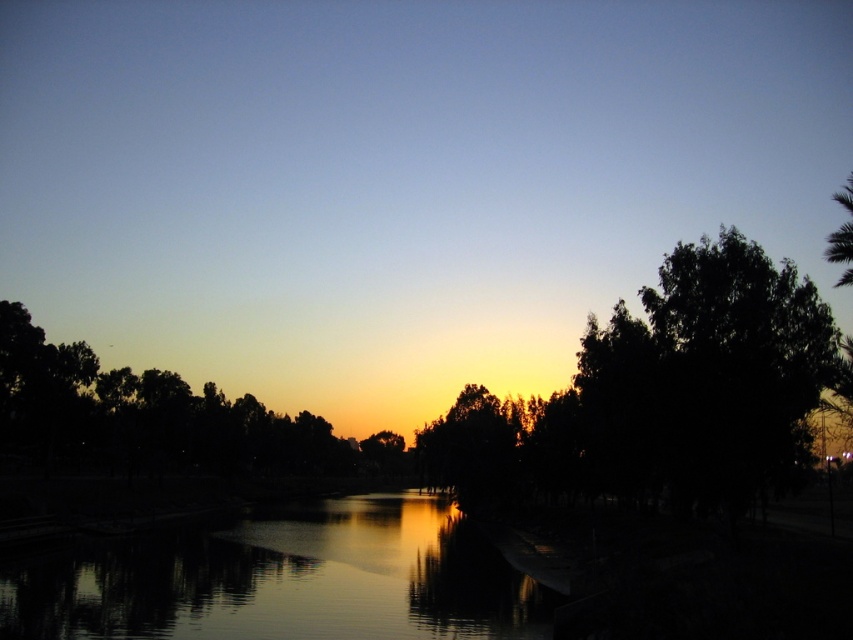
You are an artist trying to paint the sunset scene. You notice the silky smooth water at center and the green leafy tree at upper right. Which object in the scene takes up more space visually?

The green leafy tree at upper right takes up more space visually than the silky smooth water at center because the water has a smaller size compared to the tree.

You are standing on the bank of the river and see the dark green leafy tree at right and the green leafy tree at upper right. Which tree is positioned more to the left side of the scene?

The dark green leafy tree at right is positioned to the left of the green leafy tree at upper right, so it is more to the left side of the scene.

You are a bird flying over the sunset scene. You want to land on the nearest tree to rest. Which tree should you choose between the dark green leafy tree at right and the green leafy tree at upper right?

The dark green leafy tree at right is closer to you than the green leafy tree at upper right since they are 29.76 meters apart, so you should land on the dark green leafy tree at right.